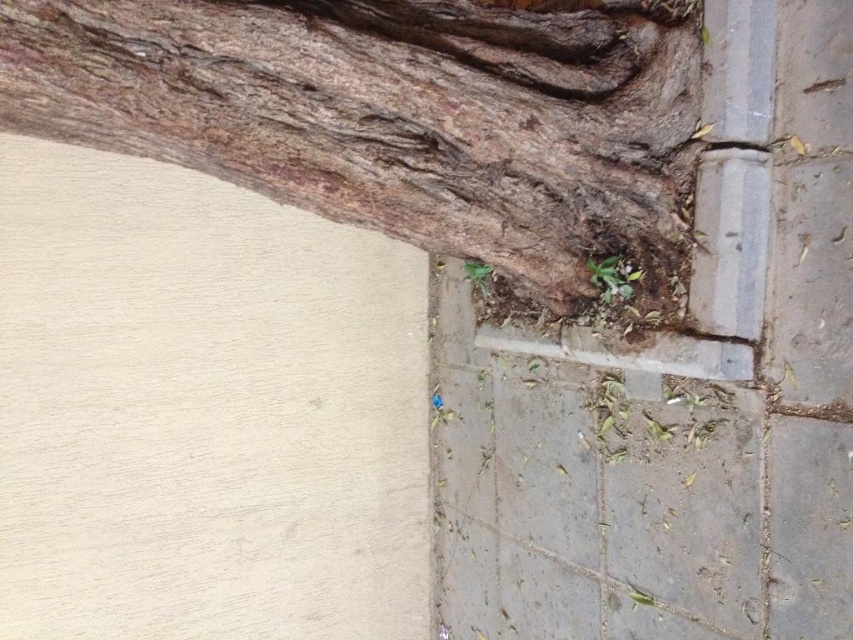
You are a gardener looking at the tree trunk and pavement area. You notice two green leafy weeds growing in the paved area. Which of the two weeds, the green leafy weed at lower right or the green leafy weed at lower center, takes up more space in the paved area?

The green leafy weed at lower center takes up more space than the green leafy weed at lower right.

You are a botanist studying tree structures. You need to locate the brown rough bark at upper left in the image. What are its coordinates?

The brown rough bark at upper left is located at coordinates point (386, 113).

You are a gardener examining the tree trunk and pavement. You need to determine which object is nearer to you when looking at the scene. Which is closer, the brown rough bark at upper left or the green leafy weed at lower center?

The brown rough bark at upper left is closer to the viewer than the green leafy weed at lower center.